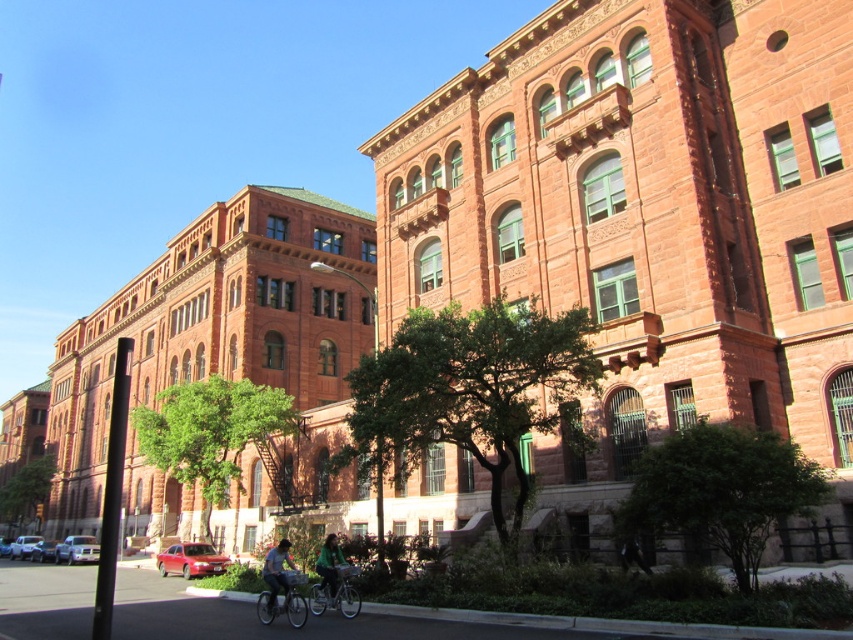
Is green matte bicycle at center to the right of green matte jacket at lower center from the viewer's perspective?

Indeed, green matte bicycle at center is positioned on the right side of green matte jacket at lower center.

Is point (347, 595) less distant than point (328, 554)?

Yes.

The image size is (853, 640). I want to click on green matte bicycle at center, so click(335, 593).

The image size is (853, 640). What do you see at coordinates (335, 593) in the screenshot?
I see `green matte bicycle at center` at bounding box center [335, 593].

Is green matte bicycle at center closer to the viewer compared to green fabric jacket at lower center?

That is False.

Measure the distance between point (344, 577) and camera.

They are 42.71 meters apart.

Locate an element on the screen. This screenshot has width=853, height=640. green matte bicycle at center is located at coordinates (335, 593).

Does point (349, 616) lie in front of point (267, 618)?

No, (349, 616) is further to viewer.

I want to click on green matte bicycle at center, so click(335, 593).